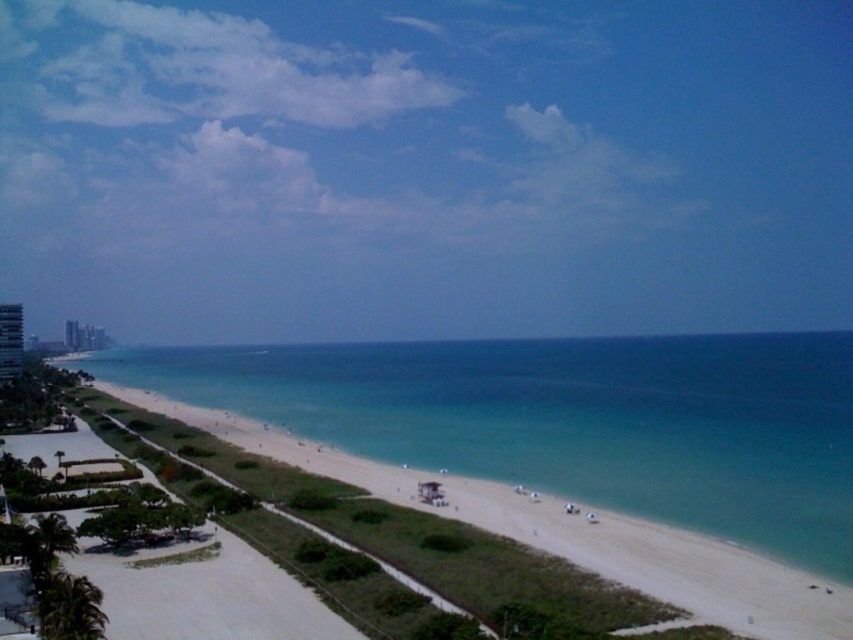
Between clear blue water at center and white concrete building at left, which one appears on the right side from the viewer's perspective?

From the viewer's perspective, clear blue water at center appears more on the right side.

I want to click on clear blue water at center, so tap(570, 420).